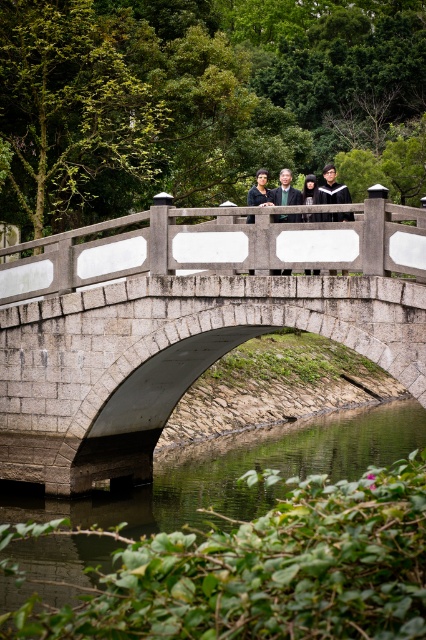
Question: Is gray stone bridge at center bigger than matte black jackets at center?

Choices:
 (A) no
 (B) yes

Answer: (B)

Question: Which of the following is the farthest from the observer?

Choices:
 (A) (284, 177)
 (B) (60, 284)
 (C) (299, 214)
 (D) (319, 554)

Answer: (A)

Question: Does gray stone bridge at center appear over matte black jackets at center?

Choices:
 (A) yes
 (B) no

Answer: (B)

Question: Does gray stone bridge at center appear on the left side of dark gray suit at center?

Choices:
 (A) yes
 (B) no

Answer: (A)

Question: Among these points, which one is farthest from the camera?

Choices:
 (A) (279, 268)
 (B) (169, 336)
 (C) (271, 195)
 (D) (239, 445)

Answer: (D)

Question: Which object is positioned farthest from the gray stone bridge at center?

Choices:
 (A) smooth concrete water at center
 (B) matte black jackets at center
 (C) dark gray suit at center

Answer: (A)